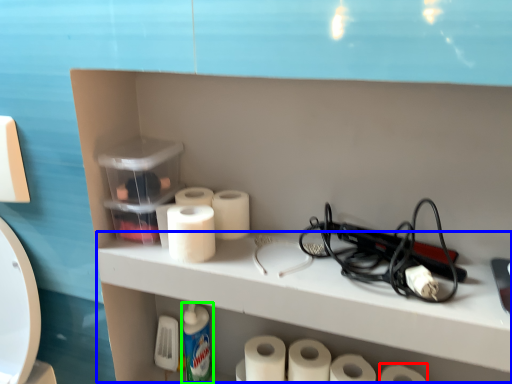
Question: Based on their relative distances, which object is farther from toilet paper (highlighted by a red box)? Choose from counter (highlighted by a blue box) and cleaning product (highlighted by a green box).

Choices:
 (A) counter
 (B) cleaning product

Answer: (B)